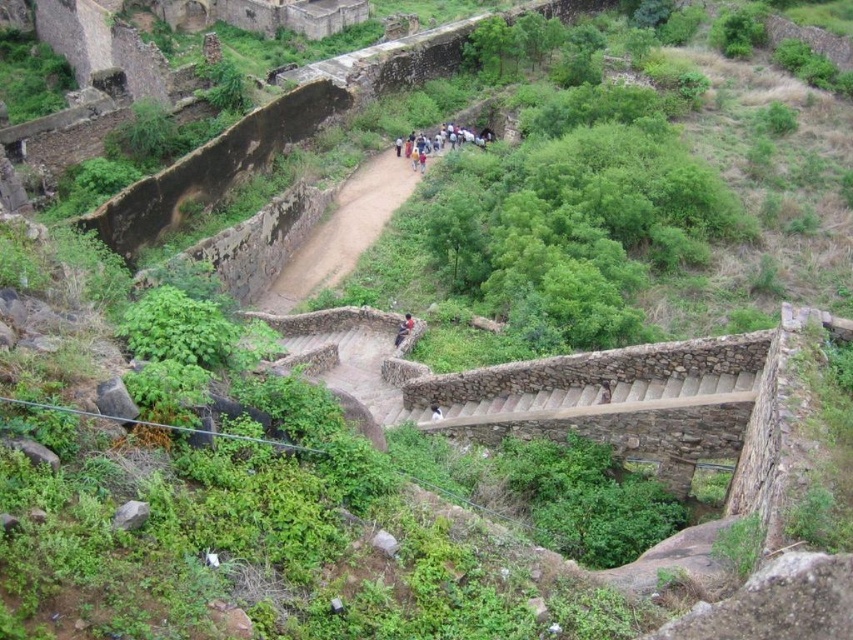
Does smooth skin person at center have a greater width compared to dark blue fabric at center?

Correct, the width of smooth skin person at center exceeds that of dark blue fabric at center.

You are a GUI agent. You are given a task and a screenshot of the screen. Output one action in this format:
    pyautogui.click(x=<x>, y=<y>)
    Task: Click on the smooth skin person at center
    This screenshot has width=853, height=640.
    Given the screenshot: What is the action you would take?
    pyautogui.click(x=403, y=330)

Is multicolored clothing group at center above smooth skin person at center?

Indeed, multicolored clothing group at center is positioned over smooth skin person at center.

Is multicolored clothing group at center closer to the viewer compared to smooth skin person at center?

No.

Is point (415, 148) less distant than point (397, 333)?

No, (415, 148) is behind (397, 333).

I want to click on multicolored clothing group at center, so point(467,134).

Who is more distant from viewer, (491, 138) or (430, 413)?

The point (491, 138) is more distant.

Who is shorter, multicolored clothing group at center or dark blue fabric at center?

Standing shorter between the two is dark blue fabric at center.

Is point (450, 147) closer to camera compared to point (433, 417)?

That is False.

Image resolution: width=853 pixels, height=640 pixels. In order to click on multicolored clothing group at center in this screenshot , I will do `click(467, 134)`.